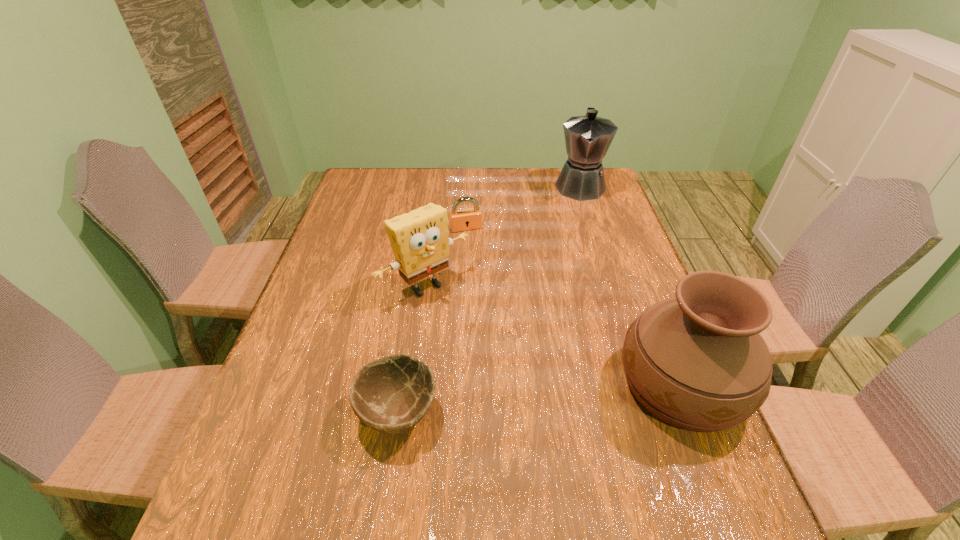
Identify the location of object that can be found as the third closest to the padlock. (697, 362).

Where is `vacant region that satisfies the following two spatial constraints: 1. on the front side of the urn; 2. on the left side of the third nearest object`? The height and width of the screenshot is (540, 960). vacant region that satisfies the following two spatial constraints: 1. on the front side of the urn; 2. on the left side of the third nearest object is located at coordinates point(413,383).

Find the location of `vacant space that satisfies the following two spatial constraints: 1. on the front side of the farthest object; 2. on the left side of the urn`. vacant space that satisfies the following two spatial constraints: 1. on the front side of the farthest object; 2. on the left side of the urn is located at coordinates (643, 383).